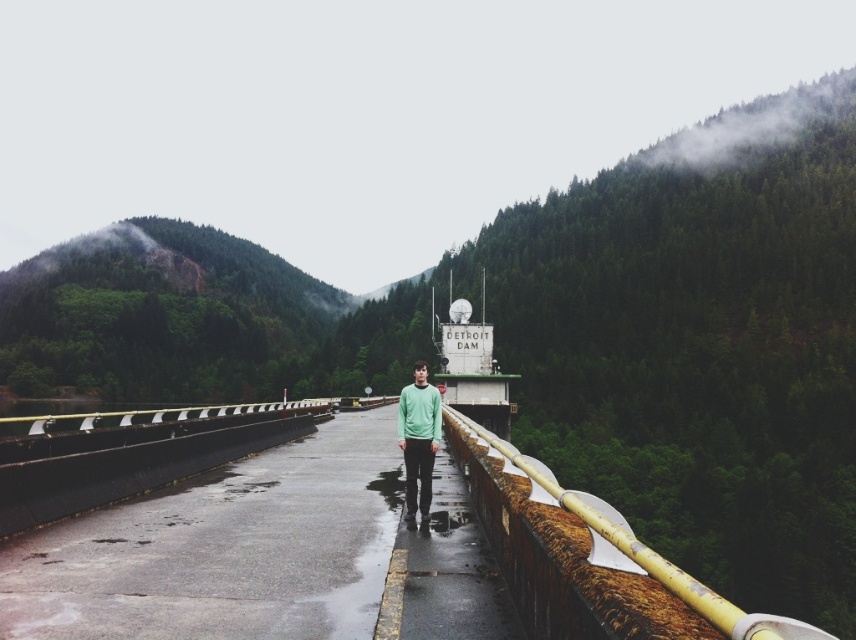
Based on the photo, measure the distance between point (531,470) and camera.

13.48 meters

Does rusty metal railing at center appear under green matte sweater at center?

Indeed, rusty metal railing at center is positioned under green matte sweater at center.

This screenshot has height=640, width=856. Describe the element at coordinates (651, 556) in the screenshot. I see `rusty metal railing at center` at that location.

The image size is (856, 640). Find the location of `rusty metal railing at center`. rusty metal railing at center is located at coordinates (651, 556).